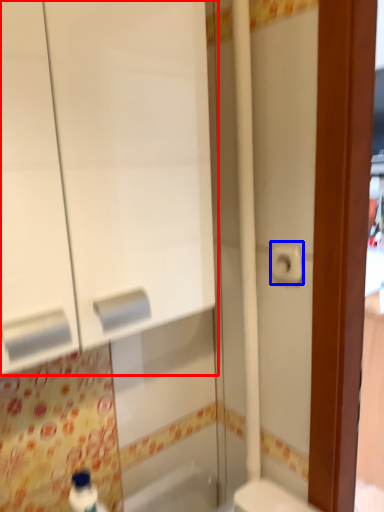
Question: Among these objects, which one is nearest to the camera, medicine cabinet (highlighted by a red box) or toilet paper (highlighted by a blue box)?

Choices:
 (A) medicine cabinet
 (B) toilet paper

Answer: (A)